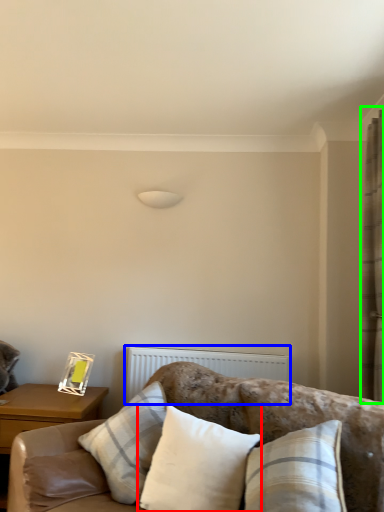
Question: Based on their relative distances, which object is nearer to pillow (highlighted by a red box)? Choose from radiator (highlighted by a blue box) and curtain (highlighted by a green box).

Choices:
 (A) radiator
 (B) curtain

Answer: (A)